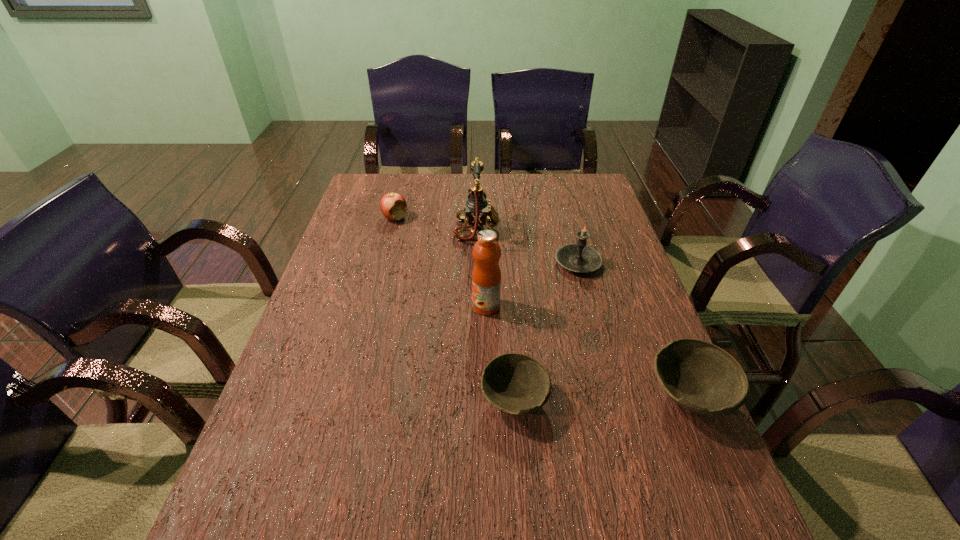
You are a GUI agent. You are given a task and a screenshot of the screen. Output one action in this format:
    pyautogui.click(x=<x>, y=<y>)
    Task: Click on the vacant area at the far edge of the desktop
    The height and width of the screenshot is (540, 960).
    Given the screenshot: What is the action you would take?
    pyautogui.click(x=529, y=199)

The image size is (960, 540). In the image, there is a desktop. What are the coordinates of `vacant region at the near edge` in the screenshot? It's located at (583, 482).

Locate an element on the screen. This screenshot has width=960, height=540. vacant space at the left edge is located at coordinates (366, 289).

In order to click on vacant space at the right edge in this screenshot , I will do `click(615, 256)`.

The image size is (960, 540). I want to click on vacant region at the near left corner of the desktop, so click(x=248, y=456).

This screenshot has width=960, height=540. What are the coordinates of `empty space between the rightmost object and the apple` in the screenshot? It's located at (542, 307).

Where is `empty location between the telephone and the third tallest object`? empty location between the telephone and the third tallest object is located at coordinates (527, 247).

At what (x,y) coordinates should I click in order to perform the action: click on free space that is in between the fourth farthest object and the third tallest object. Please return your answer as a coordinate pair (x, y). Image resolution: width=960 pixels, height=540 pixels. Looking at the image, I should click on (532, 285).

You are a GUI agent. You are given a task and a screenshot of the screen. Output one action in this format:
    pyautogui.click(x=<x>, y=<y>)
    Task: Click on the free area in between the taller bowl and the fruit juice
    Image resolution: width=960 pixels, height=540 pixels.
    Given the screenshot: What is the action you would take?
    pyautogui.click(x=588, y=351)

Image resolution: width=960 pixels, height=540 pixels. I want to click on vacant space that's between the taller bowl and the third nearest object, so click(x=588, y=351).